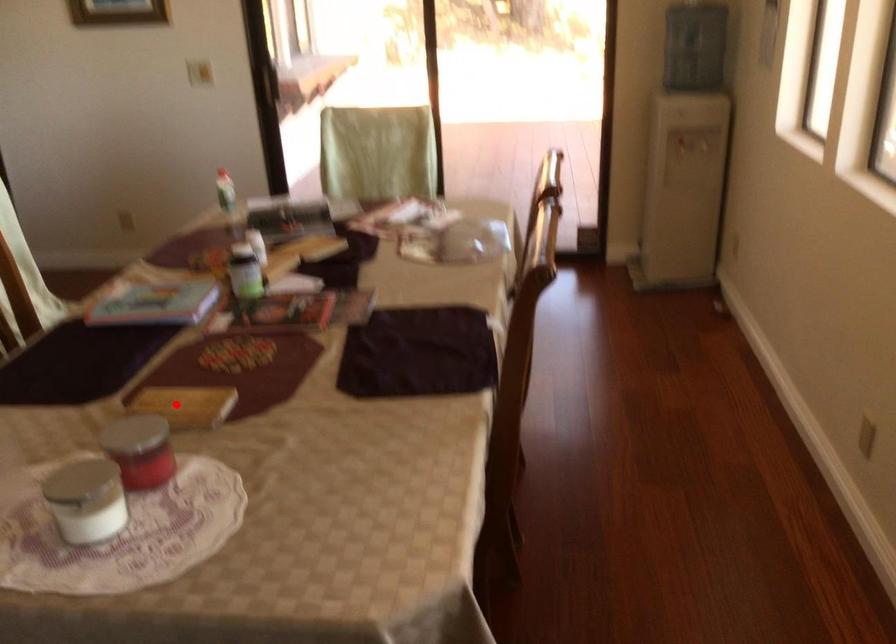
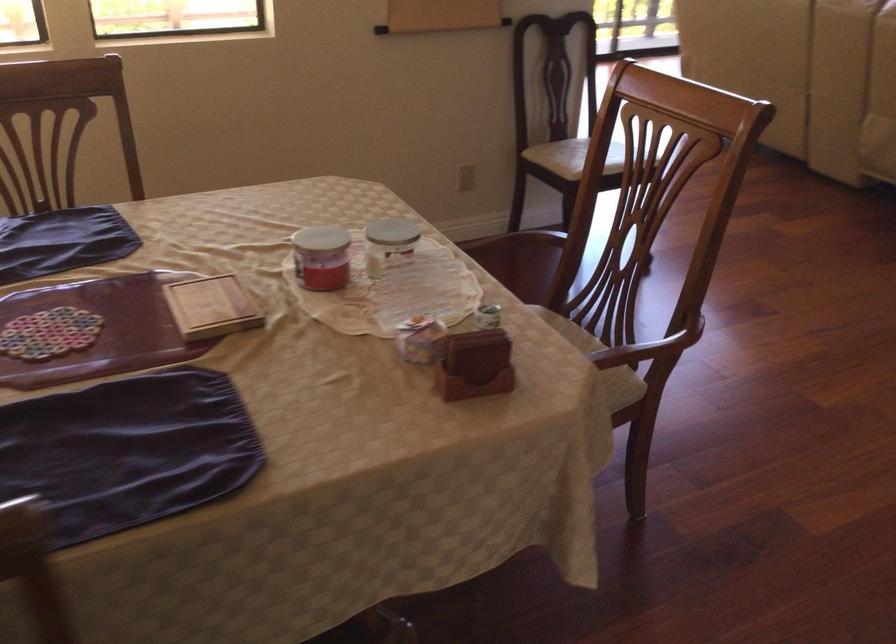
Question: I am providing you with two images of the same scene from different viewpoints. Given a red point in image1, look at the same physical point in image2. Is it:

Choices:
 (A) Closer to the viewpoint
 (B) Farther from the viewpoint

Answer: (A)